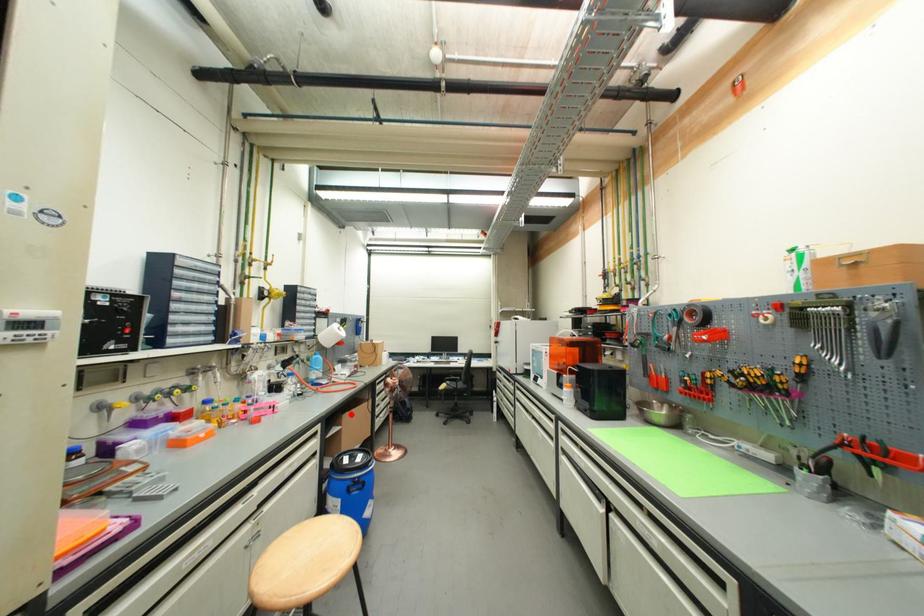
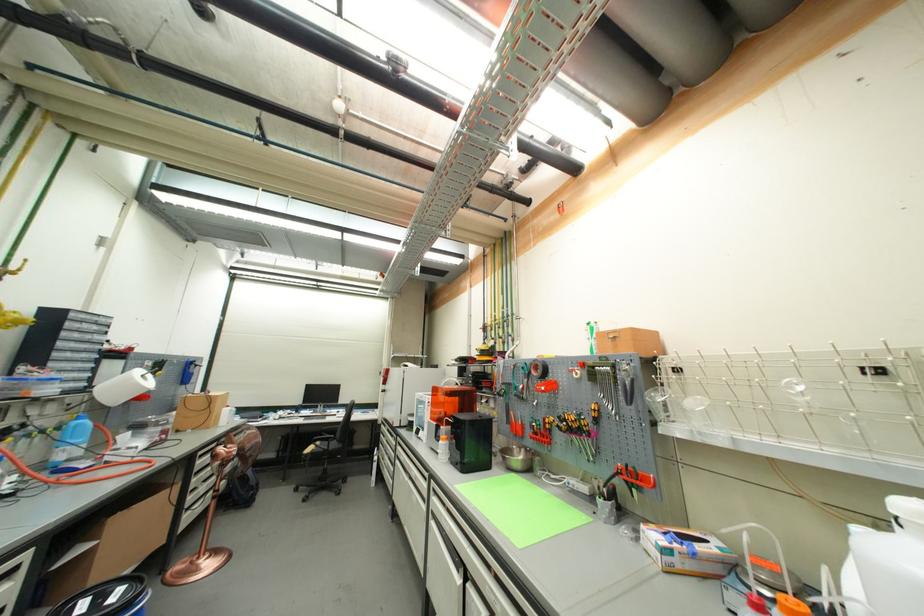
Find the pixel in the second image that matches the highlighted location in the first image.

(123, 515)